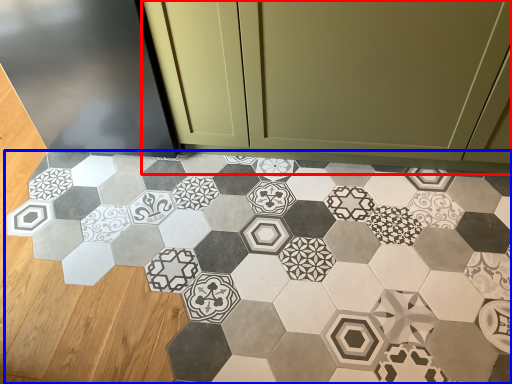
Question: Which point is closer to the camera, cabinetry (highlighted by a red box) or porcelain (highlighted by a blue box)?

Choices:
 (A) cabinetry
 (B) porcelain

Answer: (B)